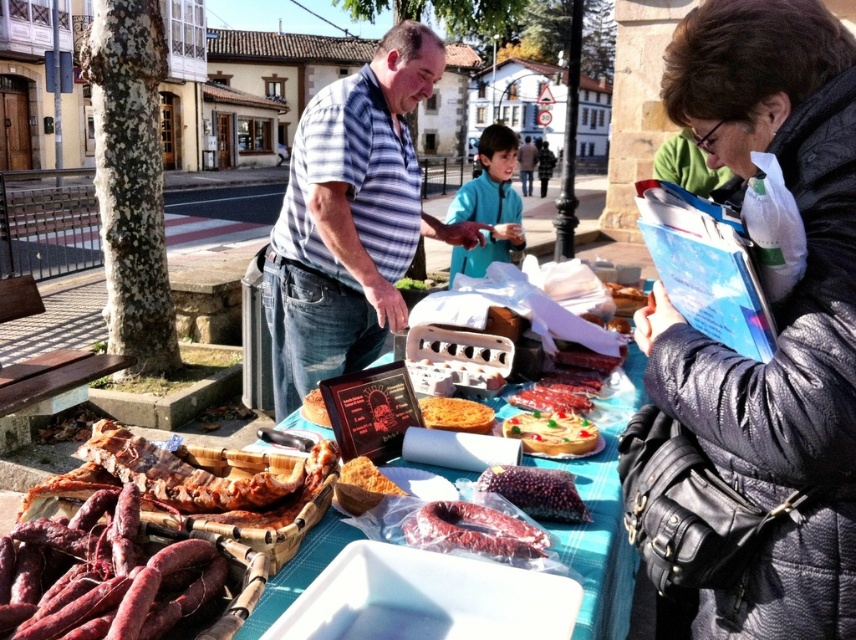
Is leather jacket at lower right wider than shiny red sausages at center?

Yes, leather jacket at lower right is wider than shiny red sausages at center.

Does leather jacket at lower right come behind shiny red sausages at center?

No, leather jacket at lower right is in front of shiny red sausages at center.

Is point (813, 224) closer to camera compared to point (518, 403)?

Yes, it is.

At what (x,y) coordinates should I click in order to perform the action: click on leather jacket at lower right. Please return your answer as a coordinate pair (x, y). Looking at the image, I should click on (753, 358).

Does dark red textured sausage at center have a larger size compared to shiny red sausages at center?

No, dark red textured sausage at center is not bigger than shiny red sausages at center.

Does dark red textured sausage at center have a greater width compared to shiny red sausages at center?

No, dark red textured sausage at center is not wider than shiny red sausages at center.

Describe the element at coordinates (536, 492) in the screenshot. The image size is (856, 640). I see `dark red textured sausage at center` at that location.

Identify the location of dark red textured sausage at center. (536, 492).

Is smoked wood ribs at lower left below reddish-brown cured sausage at center?

No, smoked wood ribs at lower left is not below reddish-brown cured sausage at center.

Is smoked wood ribs at lower left positioned before reddish-brown cured sausage at center?

Yes, smoked wood ribs at lower left is closer to the viewer.

Who is more distant from viewer, (100, 474) or (406, 532)?

The point (100, 474) is behind.

This screenshot has height=640, width=856. In order to click on smoked wood ribs at lower left in this screenshot , I will do `click(191, 477)`.